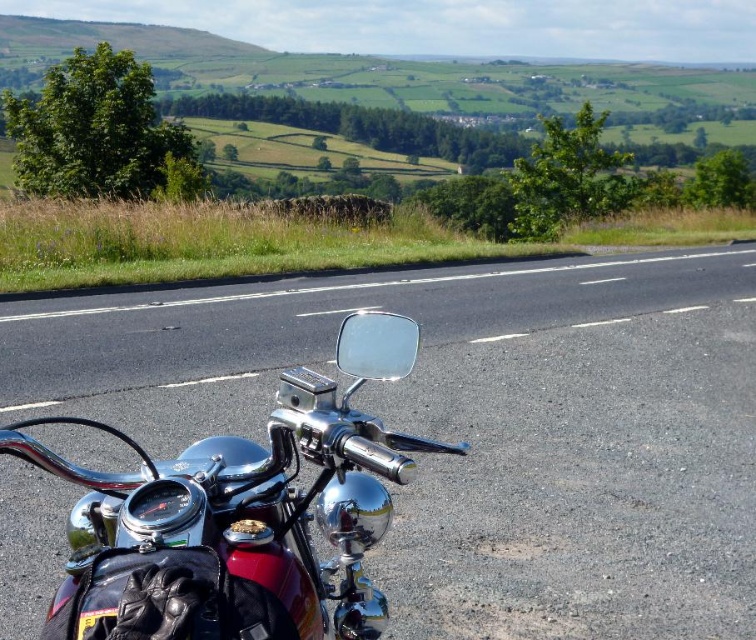
Question: Is black asphalt road at center further to the viewer compared to green grass at upper left?

Choices:
 (A) yes
 (B) no

Answer: (B)

Question: Which object is farther from the camera taking this photo?

Choices:
 (A) green grass at upper left
 (B) black asphalt road at center

Answer: (A)

Question: From the image, what is the correct spatial relationship of black asphalt road at center in relation to green grass at upper left?

Choices:
 (A) above
 (B) below

Answer: (B)

Question: Can you confirm if black asphalt road at center is positioned above green grass at upper left?

Choices:
 (A) no
 (B) yes

Answer: (A)